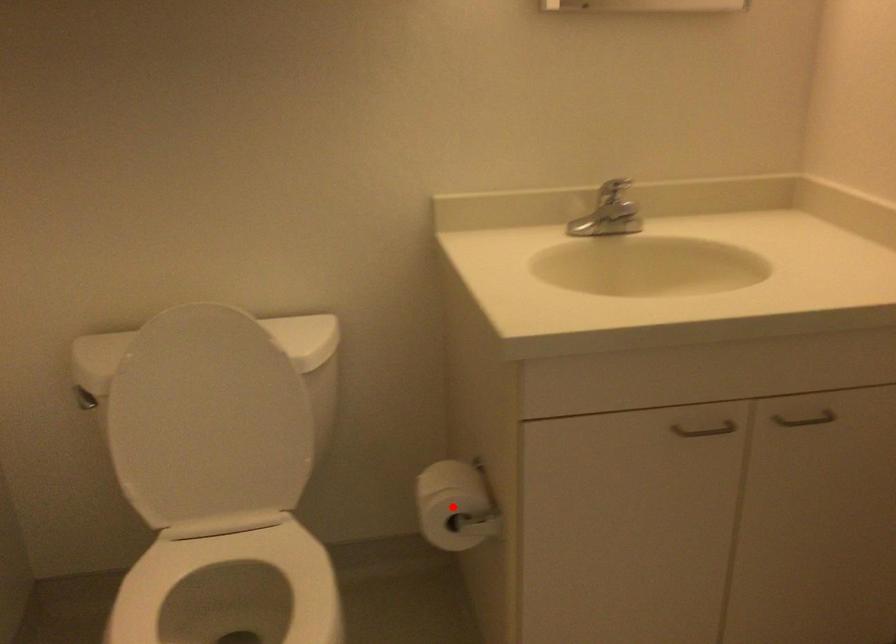
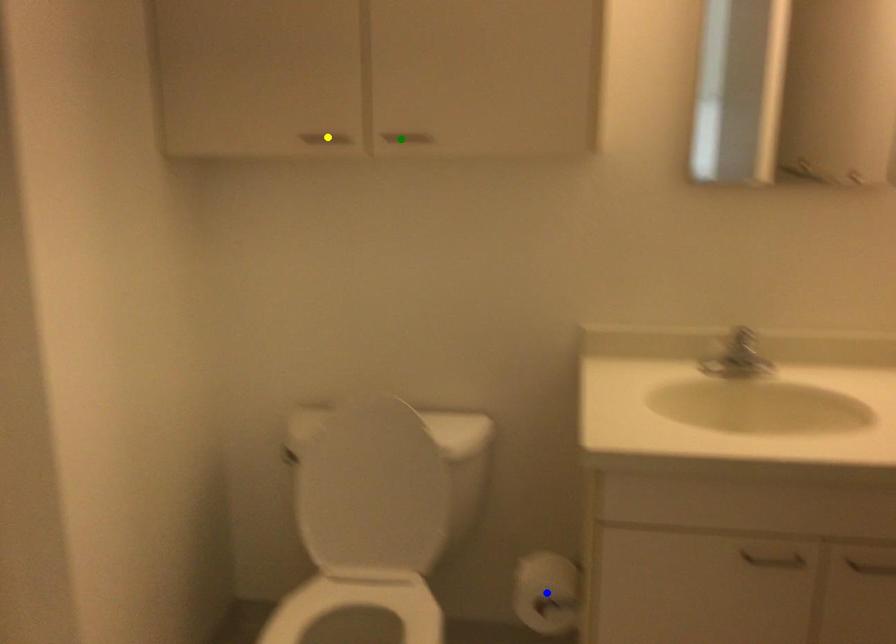
Question: I am providing you with two images of the same scene from different viewpoints. A red point is marked on the first image. You are given multiple points on the second image. In image 2, which mark is for the same physical point as the one in image 1?

Choices:
 (A) green point
 (B) yellow point
 (C) blue point

Answer: (C)